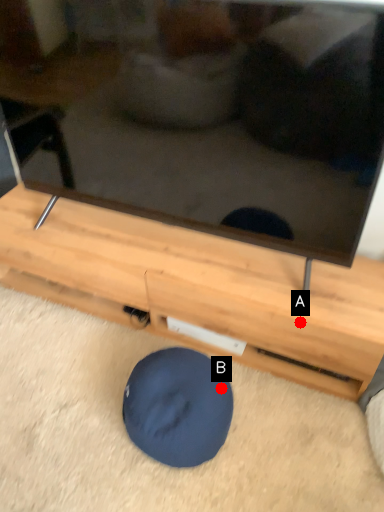
Question: Two points are circled on the image, labeled by A and B beside each circle. Which point is closer to the camera?

Choices:
 (A) A is closer
 (B) B is closer

Answer: (B)